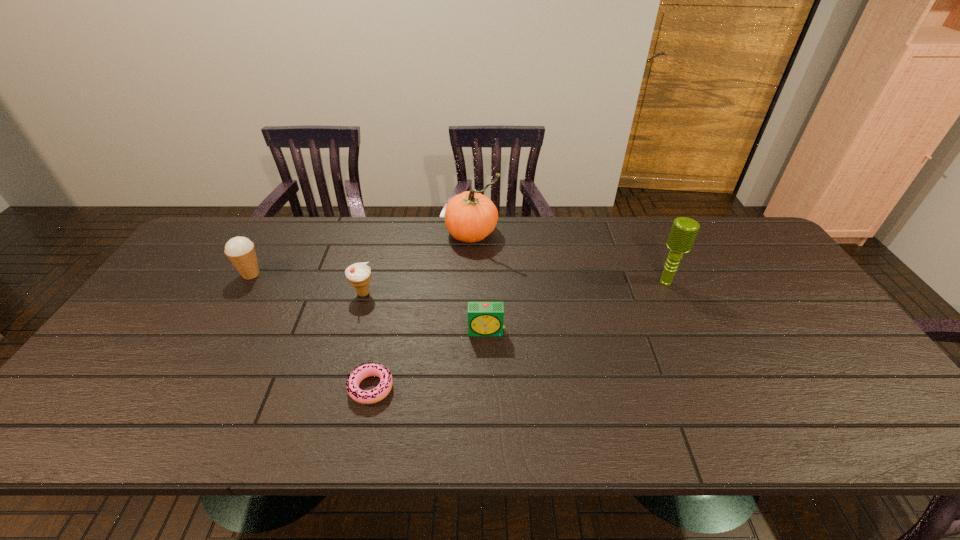
This screenshot has width=960, height=540. In the image, there is a desktop. Find the location of `vacant region at the near edge`. vacant region at the near edge is located at coordinates (202, 438).

In the image, there is a desktop. Where is `vacant space at the left edge`? vacant space at the left edge is located at coordinates [117, 403].

The image size is (960, 540). In order to click on free space at the right edge of the desktop in this screenshot , I will do `click(851, 366)`.

Identify the location of free space at the near left corner of the desktop. This screenshot has height=540, width=960. (66, 437).

I want to click on free region at the far right corner of the desktop, so click(708, 224).

The height and width of the screenshot is (540, 960). Find the location of `free space between the fifth farthest object and the right icecream`. free space between the fifth farthest object and the right icecream is located at coordinates (425, 312).

Where is `vacant space that's between the alarm clock and the right icecream`? The image size is (960, 540). vacant space that's between the alarm clock and the right icecream is located at coordinates (425, 312).

Where is `free spot between the microphone and the farther icecream`? free spot between the microphone and the farther icecream is located at coordinates (459, 278).

The height and width of the screenshot is (540, 960). I want to click on vacant area that lies between the doughnut and the farthest object, so click(x=421, y=310).

The width and height of the screenshot is (960, 540). I want to click on vacant space in between the left icecream and the right icecream, so click(x=307, y=284).